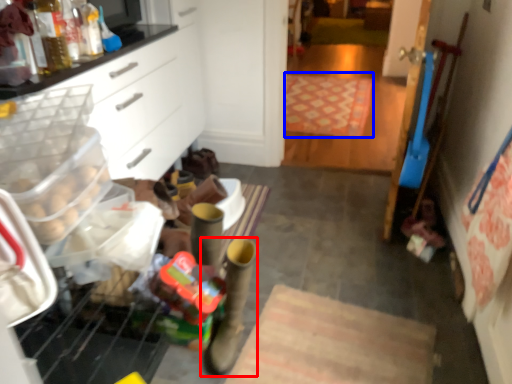
Question: Which object appears closest to the camera in this image, footwear (highlighted by a red box) or mat (highlighted by a blue box)?

Choices:
 (A) footwear
 (B) mat

Answer: (A)